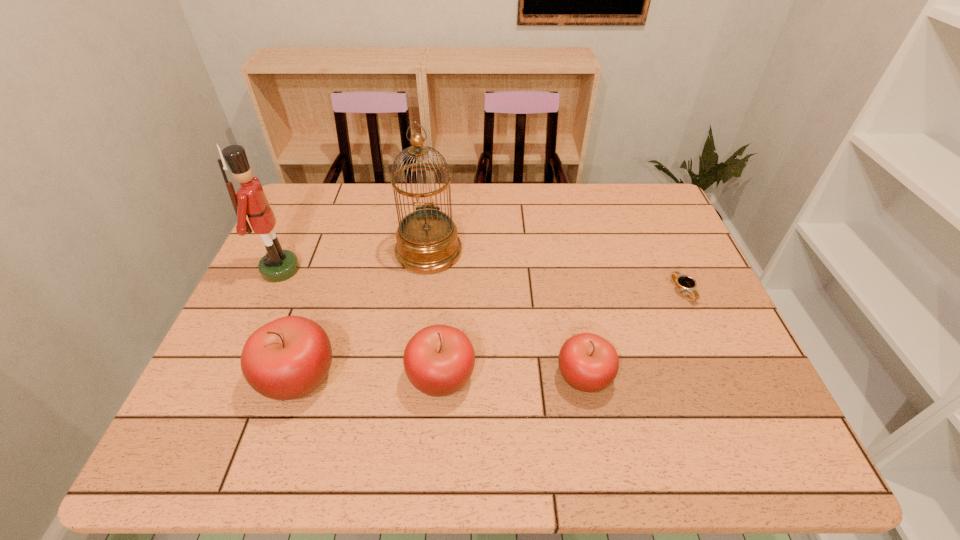
Given the evenly spaced apples in the image, where should an extra apple be added on the right to preserve the spacing? Please point to a vacant space. Please provide its 2D coordinates. Your answer should be formatted as a tuple, i.e. [(x, y)], where the tuple contains the x and y coordinates of a point satisfying the conditions above.

[(726, 376)]